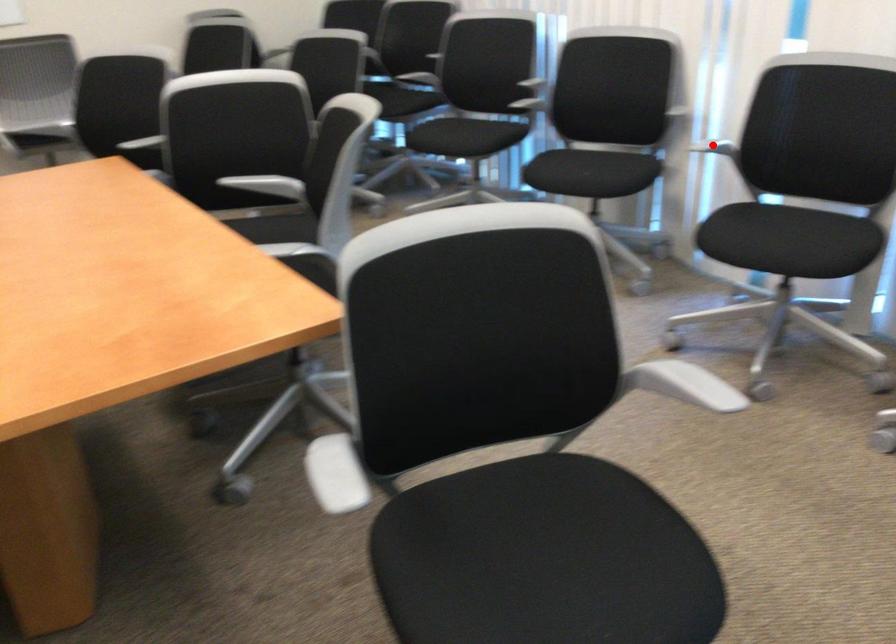
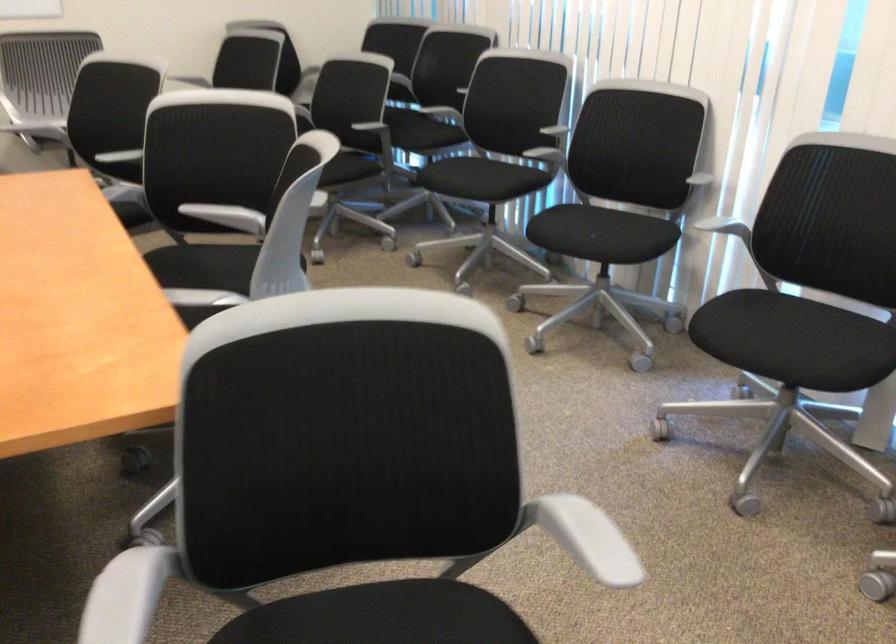
Locate, in the second image, the point that corresponds to the highlighted location in the first image.

(725, 228)